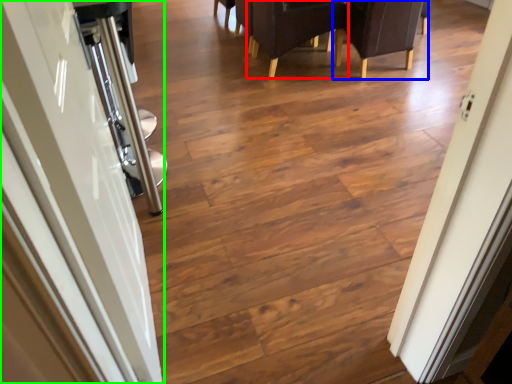
Question: Which is nearer to the armchair (highlighted by a red box)? armchair (highlighted by a blue box) or door (highlighted by a green box).

Choices:
 (A) armchair
 (B) door

Answer: (A)